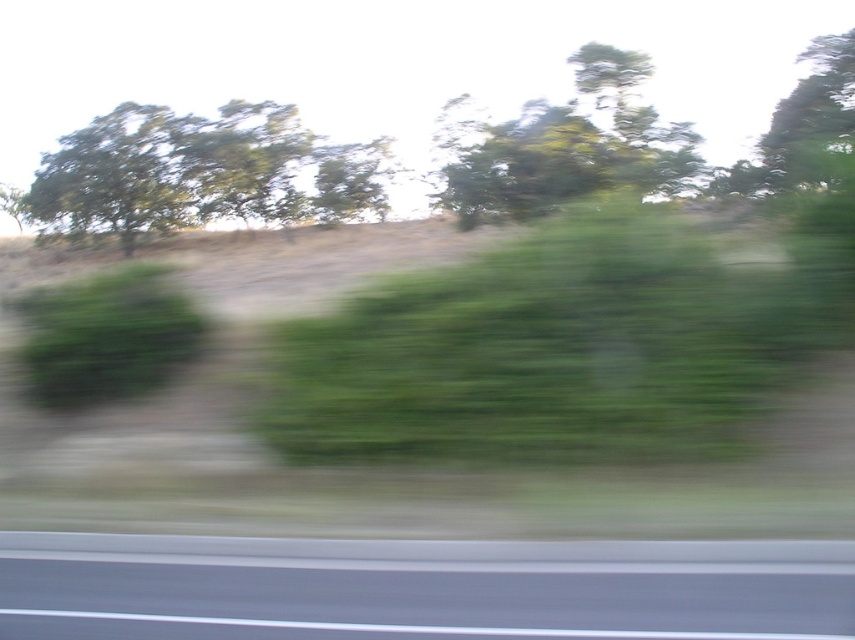
You are a passenger in a car driving on a highway. You notice the green leafy tree at upper center and the green leafy bush at left through the window. Which one is located to the right side of the other?

The green leafy tree at upper center is positioned on the right side of green leafy bush at left, so the tree is to the right of the bush.

You are a driver navigating a highway and see the image. You need to determine the exact position of the green leafy tree at upper left in the image. What are its coordinates?

The green leafy tree at upper left is located at coordinates (196, 173).

You are a photographer trying to capture the tallest tree in the image. You see the green leafy tree at upper center and the green leafy tree at upper right. Which one should you focus on to capture the tallest tree?

The green leafy tree at upper center is much taller than the green leafy tree at upper right, so you should focus on the green leafy tree at upper center to capture the tallest tree.